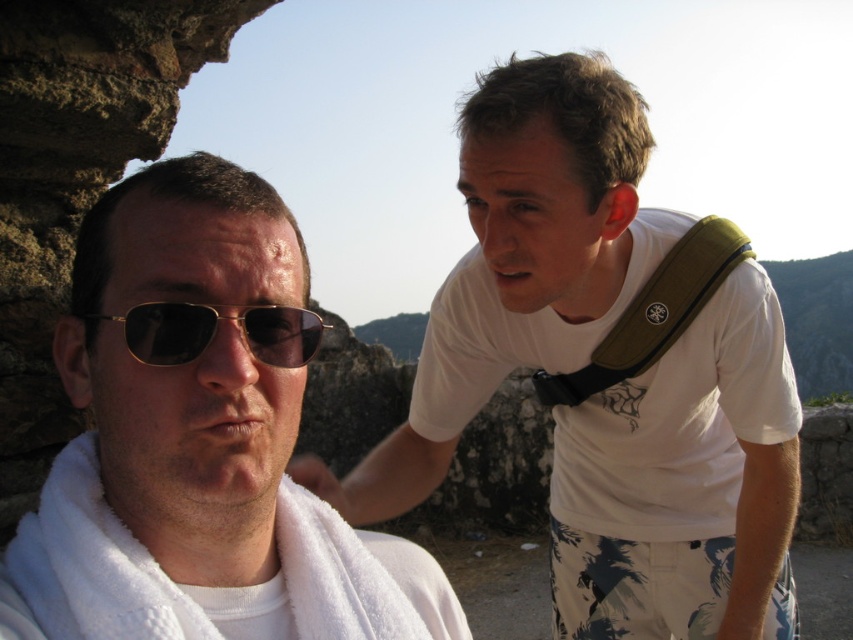
Can you confirm if white cotton shirt at upper right is bigger than green fabric strap at upper right?

Yes, white cotton shirt at upper right is bigger than green fabric strap at upper right.

Between point (467, 317) and point (614, 328), which one is positioned in front?

Point (614, 328) is in front.

Is point (753, 605) less distant than point (624, 356)?

That is False.

At what (x,y) coordinates should I click in order to perform the action: click on white cotton shirt at upper right. Please return your answer as a coordinate pair (x, y). Looking at the image, I should click on (683, 484).

You are a GUI agent. You are given a task and a screenshot of the screen. Output one action in this format:
    pyautogui.click(x=<x>, y=<y>)
    Task: Click on the white cotton shirt at upper right
    
    Given the screenshot: What is the action you would take?
    pyautogui.click(x=683, y=484)

You are a GUI agent. You are given a task and a screenshot of the screen. Output one action in this format:
    pyautogui.click(x=<x>, y=<y>)
    Task: Click on the white cotton shirt at upper right
    This screenshot has height=640, width=853.
    Given the screenshot: What is the action you would take?
    pyautogui.click(x=683, y=484)

Is green fabric strap at upper right below gold metallic sunglasses at left?

Incorrect, green fabric strap at upper right is not positioned below gold metallic sunglasses at left.

Is green fabric strap at upper right taller than gold metallic sunglasses at left?

Indeed, green fabric strap at upper right has a greater height compared to gold metallic sunglasses at left.

The height and width of the screenshot is (640, 853). Describe the element at coordinates (654, 312) in the screenshot. I see `green fabric strap at upper right` at that location.

The image size is (853, 640). Identify the location of green fabric strap at upper right. (654, 312).